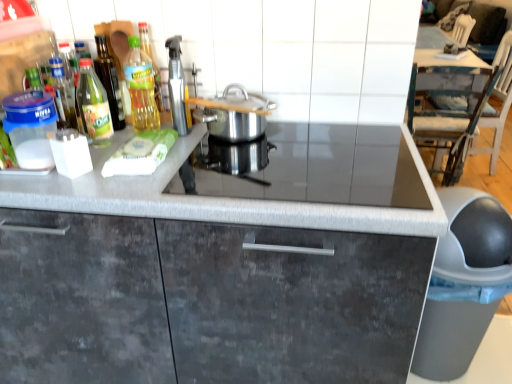
Question: Looking at the image, does black glass gas stove at center seem bigger or smaller compared to green glass bottle at left, arranged as the fourth kitchen appliance when viewed from the right?

Choices:
 (A) small
 (B) big

Answer: (B)

Question: Is black glass gas stove at center in front of or behind green glass bottle at left, the first kitchen appliance viewed from the left, in the image?

Choices:
 (A) behind
 (B) front

Answer: (B)

Question: Which of these objects is positioned closest to the gray matte trash can at lower right?

Choices:
 (A) green glass bottle at upper left, which ranks as the 2th kitchen appliance in left-to-right order
 (B) white wood chair at upper right
 (C) polished stainless steel pot at center, acting as the fourth kitchen appliance starting from the left
 (D) green glass bottle at left, the first kitchen appliance viewed from the left
 (E) silver metallic spray bottle at upper center, placed as the 3th kitchen appliance when sorted from left to right

Answer: (C)

Question: Which object is positioned closest to the green glass bottle at upper left, the third kitchen appliance when ordered from right to left?

Choices:
 (A) white wood chair at upper right
 (B) matte gray cabinet at center
 (C) gray matte trash can at lower right
 (D) green glass bottle at left, the first kitchen appliance viewed from the left
 (E) black glass gas stove at center

Answer: (D)